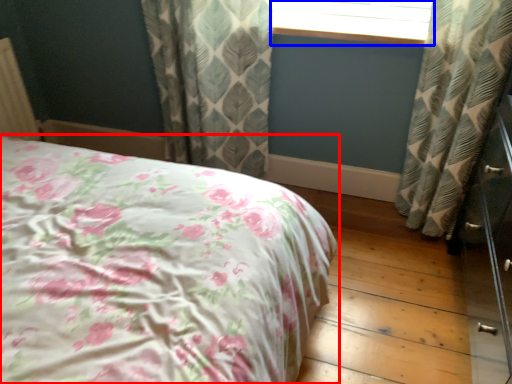
Question: Which object appears farthest to the camera in this image, bed (highlighted by a red box) or window frame (highlighted by a blue box)?

Choices:
 (A) bed
 (B) window frame

Answer: (B)